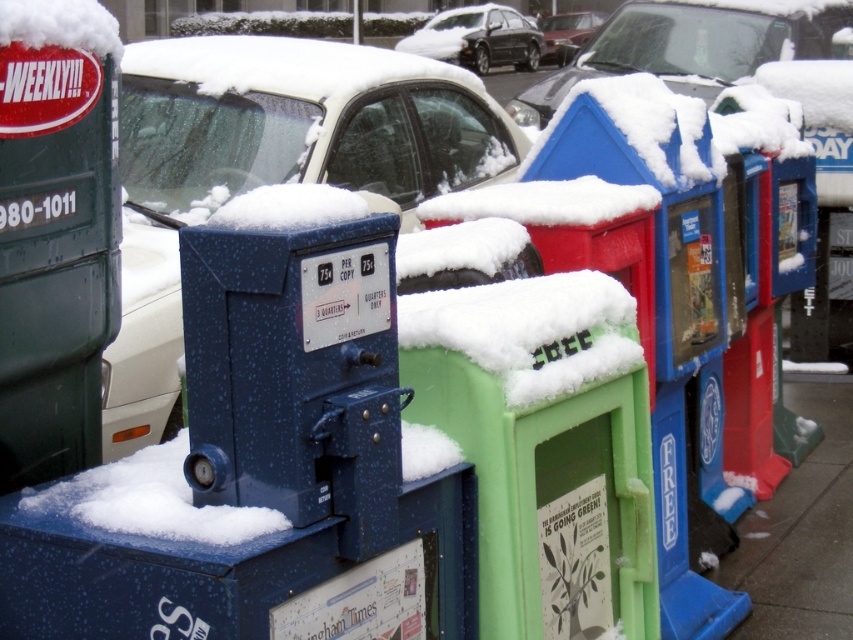
Question: Does blue metallic newspaper box at left have a greater width compared to metallic silver sedan at center?

Choices:
 (A) yes
 (B) no

Answer: (A)

Question: Is blue metallic newspaper box at left further to camera compared to snow-covered car at center?

Choices:
 (A) yes
 (B) no

Answer: (B)

Question: Considering the real-world distances, which object is farthest from the blue metallic newspaper box at left?

Choices:
 (A) snow-covered car at center
 (B) metallic silver sedan at center
 (C) black glossy sedan at center

Answer: (B)

Question: Estimate the real-world distances between objects in this image. Which object is closer to the gray concrete sidewalk at lower right?

Choices:
 (A) metallic silver sedan at center
 (B) blue metallic newspaper box at left
 (C) snow-covered car at center
 (D) white fluffy snow at upper left

Answer: (B)

Question: Which of these objects is positioned farthest from the gray concrete sidewalk at lower right?

Choices:
 (A) snow-covered car at center
 (B) metallic silver sedan at center
 (C) white fluffy snow at upper left

Answer: (B)

Question: Is black glossy sedan at center wider than white fluffy snow at upper left?

Choices:
 (A) yes
 (B) no

Answer: (A)